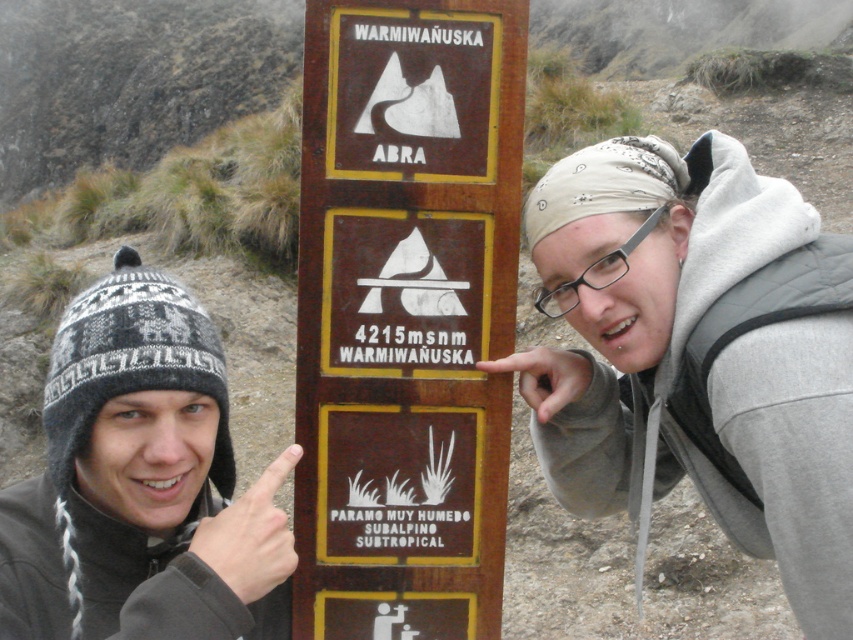
Okay, let me try to tackle this. First, I need to understand the input given. The scene is two people outdoors near a signpost with three sections. The objects listed are a gray hoodie at center and a knitted wool hat at center. The objects description says the hoodie might be wider than the hat. The user provided an incomplete question starting with

Wait, the user probably wants me to generate a proper question and answer based on the given inputs. Let me check the rules again. The question must include both objects exactly as listed. The scene context is important. The objects are